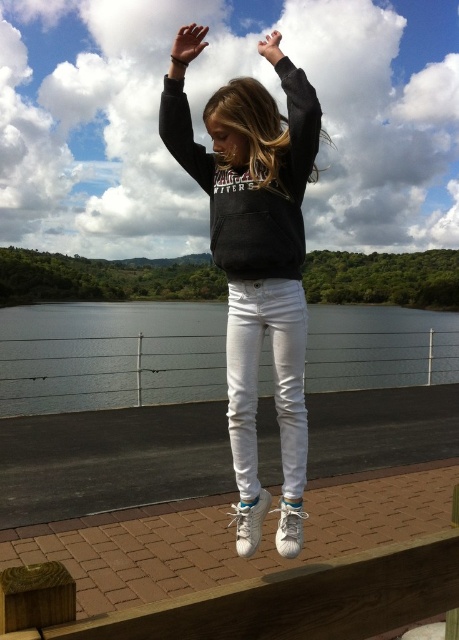
Based on the photo, measure the distance between point (80, 307) and camera.

The distance of point (80, 307) from camera is 21.30 meters.

Can you confirm if glossy water at center is smaller than black matte sweatshirt at center?

Incorrect, glossy water at center is not smaller in size than black matte sweatshirt at center.

You are a GUI agent. You are given a task and a screenshot of the screen. Output one action in this format:
    pyautogui.click(x=<x>, y=<y>)
    Task: Click on the glossy water at center
    
    Given the screenshot: What is the action you would take?
    pyautogui.click(x=110, y=355)

The image size is (459, 640). I want to click on glossy water at center, so [110, 355].

Identify the location of matte black sweatshirt at upper center. (184, 108).

Who is shorter, matte black sweatshirt at upper center or brown leather hand at upper center?

matte black sweatshirt at upper center

At what (x,y) coordinates should I click in order to perform the action: click on matte black sweatshirt at upper center. Please return your answer as a coordinate pair (x, y). The width and height of the screenshot is (459, 640). Looking at the image, I should click on (184, 108).

Is black matte sweatshirt at upper center taller than brown leather hand at upper center?

No, black matte sweatshirt at upper center is not taller than brown leather hand at upper center.

Can you confirm if black matte sweatshirt at upper center is positioned above brown leather hand at upper center?

Incorrect, black matte sweatshirt at upper center is not positioned above brown leather hand at upper center.

Find the location of `black matte sweatshirt at upper center`. black matte sweatshirt at upper center is located at coordinates (274, 140).